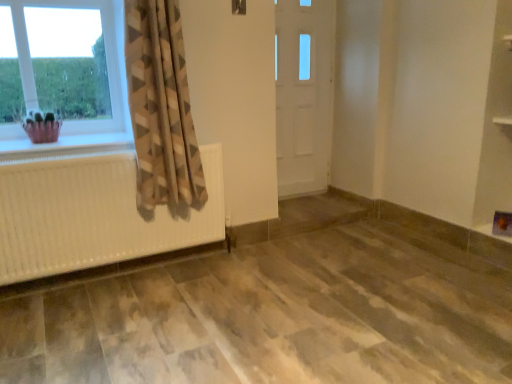
Where is `vacant area that is in front of pink fabric basket at left`? Image resolution: width=512 pixels, height=384 pixels. vacant area that is in front of pink fabric basket at left is located at coordinates (30, 146).